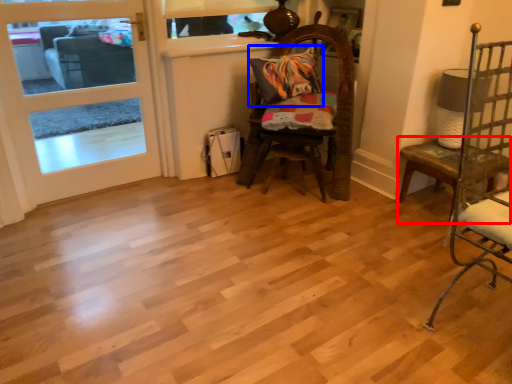
Question: Which object is closer to the camera taking this photo, table (highlighted by a red box) or pillow (highlighted by a blue box)?

Choices:
 (A) table
 (B) pillow

Answer: (A)